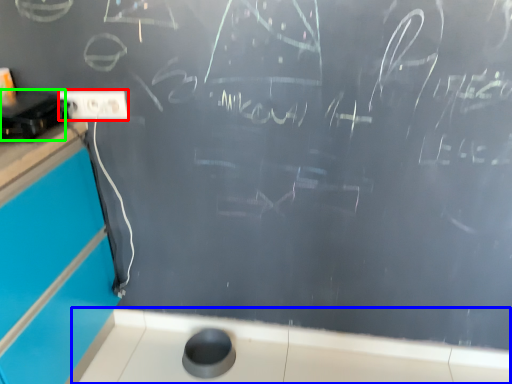
Question: Based on their relative distances, which object is nearer to electric outlet (highlighted by a red box)? Choose from counter top (highlighted by a blue box) and appliance (highlighted by a green box).

Choices:
 (A) counter top
 (B) appliance

Answer: (B)